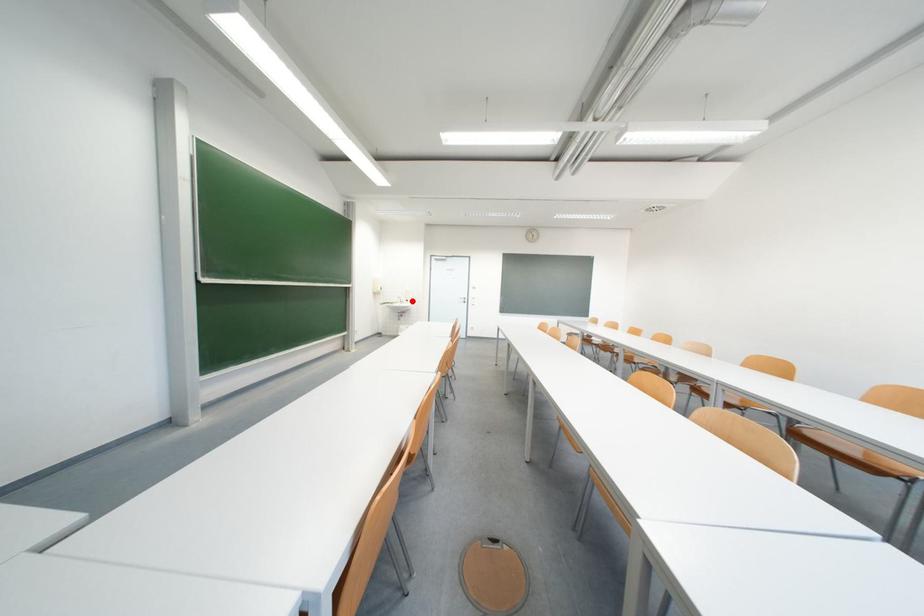
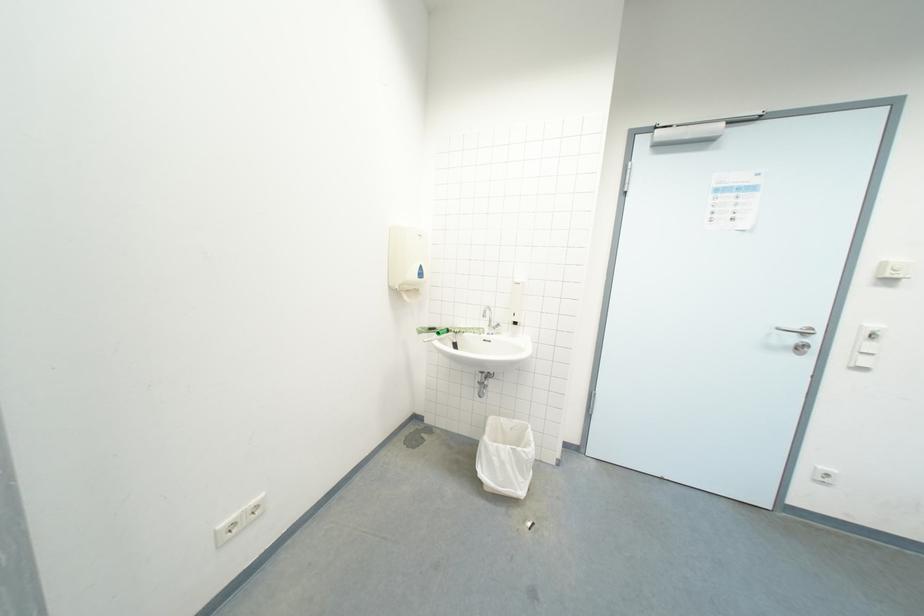
Find the pixel in the second image that matches the highlighted location in the first image.

(511, 318)